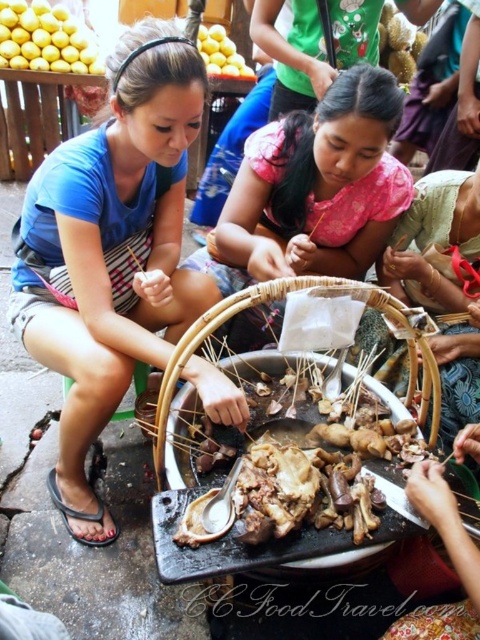
Question: Which point is closer to the camera?

Choices:
 (A) (193, 346)
 (B) (0, 36)
 (C) (166, 268)
 (D) (214, 67)

Answer: (A)

Question: Which point is farther to the camera?

Choices:
 (A) yellow matte lemons at upper left
 (B) yellow matte lemons at upper center

Answer: (B)

Question: Which is nearer to the yellow matte lemons at upper center?

Choices:
 (A) yellow matte lemons at upper left
 (B) woven bamboo basket at center
 (C) brown matte bone at center
 (D) green fabric headscarf at center

Answer: (A)

Question: Is green fabric headscarf at center positioned behind yellow matte lemons at upper left?

Choices:
 (A) no
 (B) yes

Answer: (A)

Question: Is green fabric headscarf at center smaller than woven bamboo basket at center?

Choices:
 (A) no
 (B) yes

Answer: (B)

Question: From the image, what is the correct spatial relationship of blue fabric shirt at upper left in relation to brown matte bone at center?

Choices:
 (A) left
 (B) right

Answer: (A)